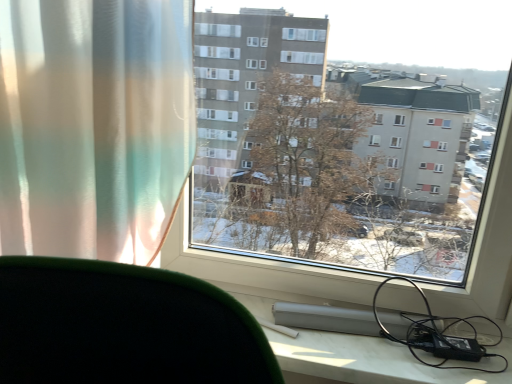
Question: Is black rubber cable at lower right oriented away from transparent glass window at center?

Choices:
 (A) yes
 (B) no

Answer: (A)

Question: From the image's perspective, would you say black rubber cable at lower right is shown under transparent glass window at center?

Choices:
 (A) no
 (B) yes

Answer: (B)

Question: Is black rubber cable at lower right further to camera compared to transparent glass window at center?

Choices:
 (A) yes
 (B) no

Answer: (A)

Question: Is black rubber cable at lower right beside transparent glass window at center?

Choices:
 (A) no
 (B) yes

Answer: (A)

Question: Does black rubber cable at lower right appear on the right side of transparent glass window at center?

Choices:
 (A) no
 (B) yes

Answer: (B)

Question: Does black rubber cable at lower right have a greater width compared to transparent glass window at center?

Choices:
 (A) yes
 (B) no

Answer: (B)

Question: Is translucent fabric curtain at left positioned before transparent glass window at center?

Choices:
 (A) no
 (B) yes

Answer: (B)

Question: Is translucent fabric curtain at left positioned behind transparent glass window at center?

Choices:
 (A) no
 (B) yes

Answer: (A)

Question: Is translucent fabric curtain at left bigger than transparent glass window at center?

Choices:
 (A) yes
 (B) no

Answer: (B)

Question: Is transparent glass window at center a part of translucent fabric curtain at left?

Choices:
 (A) no
 (B) yes

Answer: (A)

Question: Is translucent fabric curtain at left outside transparent glass window at center?

Choices:
 (A) yes
 (B) no

Answer: (A)

Question: Does translucent fabric curtain at left have a lesser height compared to transparent glass window at center?

Choices:
 (A) yes
 (B) no

Answer: (A)

Question: Is transparent glass window at center closer to the viewer compared to translucent fabric curtain at left?

Choices:
 (A) no
 (B) yes

Answer: (A)